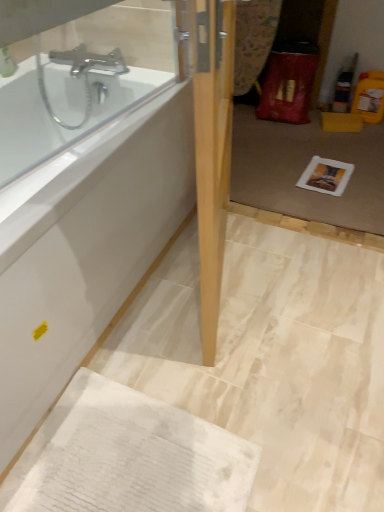
At what (x,y) coordinates should I click in order to perform the action: click on vacant area situated below transparent glass door at center (from a real-world perspective). Please return your answer as a coordinate pair (x, y). This screenshot has width=384, height=512. Looking at the image, I should click on (301, 229).